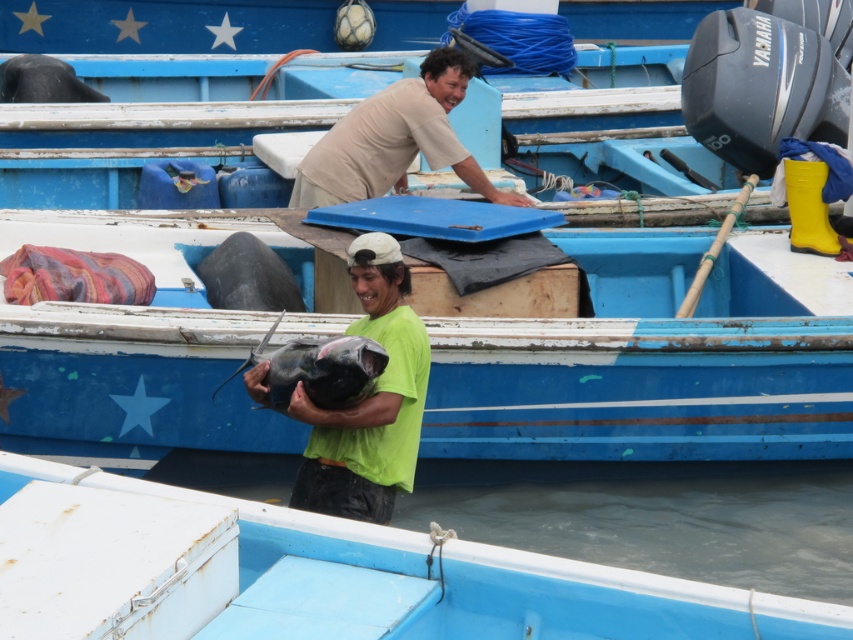
You are a photographer standing at the edge of the dock. You want to take a photo that includes both the light brown cotton shirt at upper center and the dark gray matte fish at center. The camera you are using has a maximum focus range of 35 inches. Can you capture both subjects in focus without moving your position?

The light brown cotton shirt at upper center is 37.53 inches from the dark gray matte fish at center. Since the distance exceeds the camera maximum focus range of 35 inches, you cannot capture both subjects in focus without moving your position.

You are a photographer trying to capture the man in the green matte shirt at center. Based on the coordinates provided, where should you position your camera relative to the scene?

The green matte shirt at center is located at point coordinates, so position the camera directly facing the center area to capture the subject.

You are a photographer trying to capture a closeup of the green matte shirt at center and the shiny dark gray fish at center. Since you want both subjects to appear clearly in the photo, which subject should you focus on to ensure the larger one is in sharp focus?

The green matte shirt at center is larger in size than the shiny dark gray fish at center, so you should focus on the green matte shirt at center to ensure the larger subject is in sharp focus.